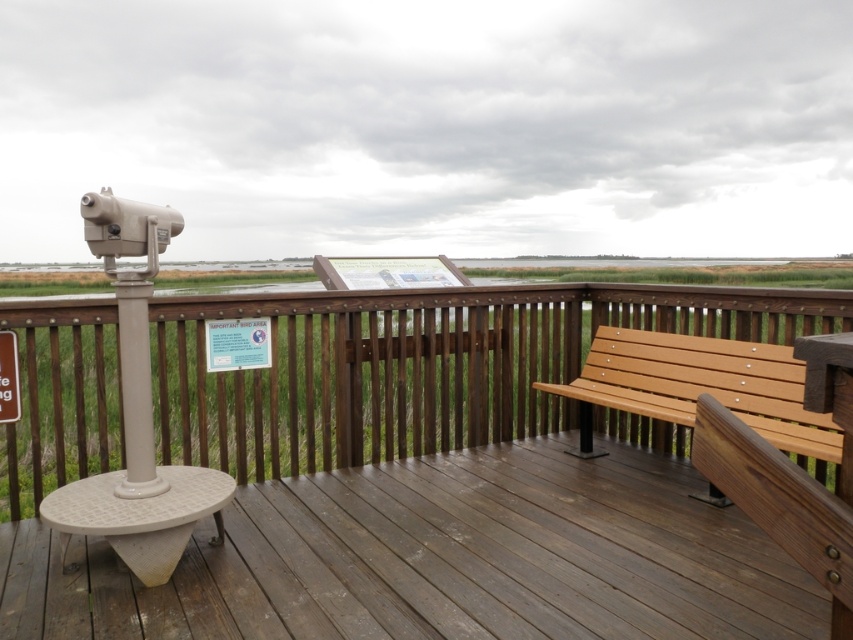
Question: Is wooden bench at center positioned in front of wooden bench at right?

Choices:
 (A) yes
 (B) no

Answer: (B)

Question: Which of the following is the farthest from the observer?

Choices:
 (A) (740, 388)
 (B) (3, 483)

Answer: (B)

Question: Does wooden bench at center have a larger size compared to wooden bench at right?

Choices:
 (A) no
 (B) yes

Answer: (B)

Question: Does wooden bench at center appear under wooden bench at right?

Choices:
 (A) yes
 (B) no

Answer: (B)

Question: Among these objects, which one is nearest to the camera?

Choices:
 (A) wooden bench at right
 (B) wooden bench at center

Answer: (A)